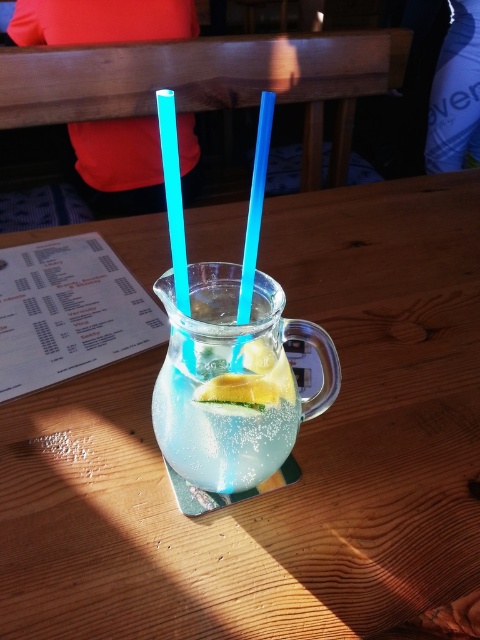
Question: Based on their relative distances, which object is nearer to the blue translucent straw at center?

Choices:
 (A) clear glass pitcher at center
 (B) yellow matte lemon at center
 (C) wooden table at center

Answer: (A)

Question: From the image, what is the correct spatial relationship of wooden table at center in relation to yellow matte lemon at center?

Choices:
 (A) right
 (B) left

Answer: (B)

Question: Is blue translucent straw at center bigger than yellow matte lemon at center?

Choices:
 (A) yes
 (B) no

Answer: (A)

Question: Is wooden table at center closer to the viewer compared to blue translucent straw at center?

Choices:
 (A) yes
 (B) no

Answer: (B)

Question: Which point is closer to the camera taking this photo?

Choices:
 (A) (233, 436)
 (B) (333, 605)
 (C) (268, 132)
 (D) (220, 387)

Answer: (C)

Question: Which point appears closest to the camera in this image?

Choices:
 (A) (393, 636)
 (B) (248, 314)

Answer: (A)